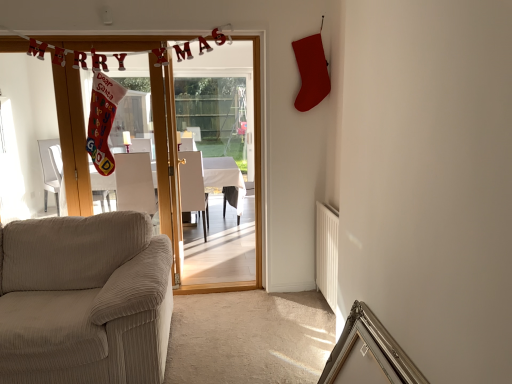
Question: Does wooden door at center come behind beige corduroy couch at lower left?

Choices:
 (A) yes
 (B) no

Answer: (A)

Question: Does wooden door at center come in front of beige corduroy couch at lower left?

Choices:
 (A) yes
 (B) no

Answer: (B)

Question: Does wooden door at center appear on the right side of beige corduroy couch at lower left?

Choices:
 (A) yes
 (B) no

Answer: (A)

Question: From the image's perspective, is wooden door at center located above beige corduroy couch at lower left?

Choices:
 (A) yes
 (B) no

Answer: (A)

Question: Is wooden door at center not inside beige corduroy couch at lower left?

Choices:
 (A) yes
 (B) no

Answer: (A)

Question: Looking at their shapes, would you say white fabric armchair at center, positioned as the 1th armchair in right-to-left order, is wider or thinner than white corduroy armchair at center, which is counted as the 1th armchair, starting from the left?

Choices:
 (A) thin
 (B) wide

Answer: (B)

Question: Based on their sizes in the image, would you say white fabric armchair at center, positioned as the 1th armchair in right-to-left order, is bigger or smaller than white corduroy armchair at center, which is counted as the 1th armchair, starting from the left?

Choices:
 (A) small
 (B) big

Answer: (B)

Question: From the image's perspective, is white fabric armchair at center, which is the second armchair in left-to-right order, positioned above or below white corduroy armchair at center, which is counted as the 1th armchair, starting from the left?

Choices:
 (A) below
 (B) above

Answer: (A)

Question: Is point (182, 210) positioned closer to the camera than point (120, 155)?

Choices:
 (A) closer
 (B) farther

Answer: (A)

Question: Looking at the image, does wooden door at center seem bigger or smaller compared to white corduroy armchair at center, acting as the 2th armchair starting from the right?

Choices:
 (A) big
 (B) small

Answer: (A)

Question: Looking at their shapes, would you say wooden door at center is wider or thinner than white corduroy armchair at center, which is counted as the 1th armchair, starting from the left?

Choices:
 (A) thin
 (B) wide

Answer: (A)

Question: Do you think wooden door at center is within white corduroy armchair at center, which is counted as the 1th armchair, starting from the left, or outside of it?

Choices:
 (A) inside
 (B) outside

Answer: (B)

Question: Is wooden door at center to the left or to the right of white corduroy armchair at center, acting as the 2th armchair starting from the right, in the image?

Choices:
 (A) right
 (B) left

Answer: (A)

Question: From the image's perspective, is wooden door at center positioned above or below white glossy table at center?

Choices:
 (A) above
 (B) below

Answer: (A)

Question: Is wooden door at center wider or thinner than white glossy table at center?

Choices:
 (A) thin
 (B) wide

Answer: (A)